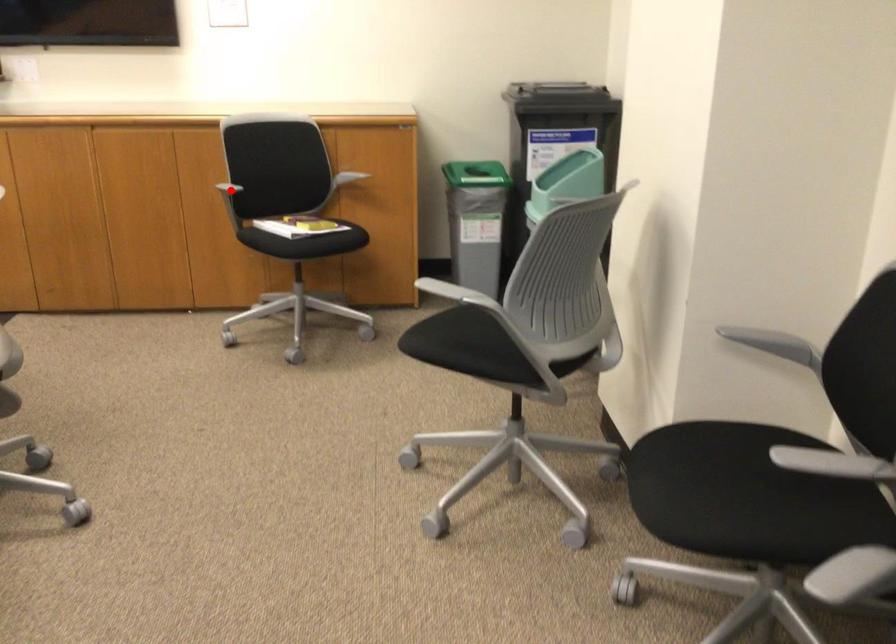
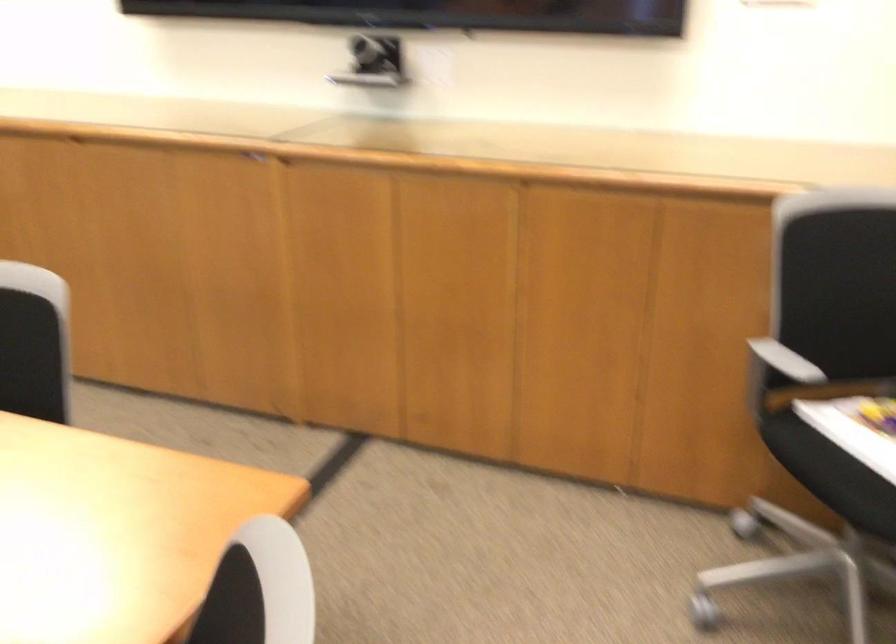
In the second image, find the point that corresponds to the highlighted location in the first image.

(778, 374)